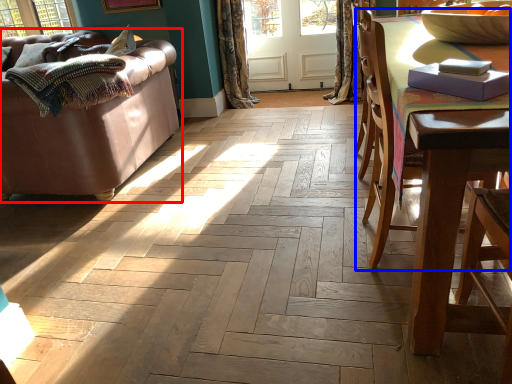
Question: Which object appears farthest to the camera in this image, studio couch (highlighted by a red box) or chair (highlighted by a blue box)?

Choices:
 (A) studio couch
 (B) chair

Answer: (A)